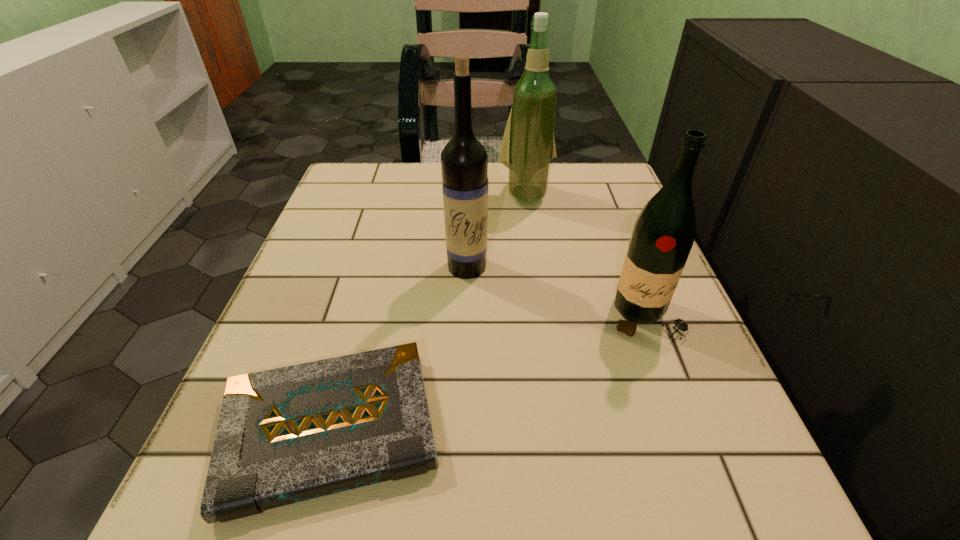
The height and width of the screenshot is (540, 960). I want to click on vacant region at the far left corner of the desktop, so click(x=375, y=190).

I want to click on free space at the far right corner of the desktop, so click(x=611, y=183).

Where is `vacant space at the near right corner`? This screenshot has width=960, height=540. vacant space at the near right corner is located at coordinates (699, 503).

Locate an element on the screen. free point between the farthest object and the nearest wine bottle is located at coordinates (585, 256).

Locate an element on the screen. This screenshot has width=960, height=540. vacant space that's between the farthest wine bottle and the third farthest object is located at coordinates (585, 256).

You are a GUI agent. You are given a task and a screenshot of the screen. Output one action in this format:
    pyautogui.click(x=<x>, y=<y>)
    Task: Click on the vacant space that is in between the farthest object and the second farthest wine bottle
    The image size is (960, 540).
    Given the screenshot: What is the action you would take?
    pyautogui.click(x=496, y=231)

At what (x,y) coordinates should I click in order to perform the action: click on unoccupied area between the shortest wine bottle and the farthest wine bottle. Please return your answer as a coordinate pair (x, y). The image size is (960, 540). Looking at the image, I should click on (585, 256).

Find the location of a particular element. This screenshot has width=960, height=540. blank region between the second object from right to left and the shortest object is located at coordinates (428, 312).

At what (x,y) coordinates should I click in order to perform the action: click on vacant point located between the third nearest object and the third farthest object. Please return your answer as a coordinate pair (x, y). The height and width of the screenshot is (540, 960). Looking at the image, I should click on (556, 292).

Identify the location of free point between the second object from right to left and the second farthest object. The image size is (960, 540). (496, 231).